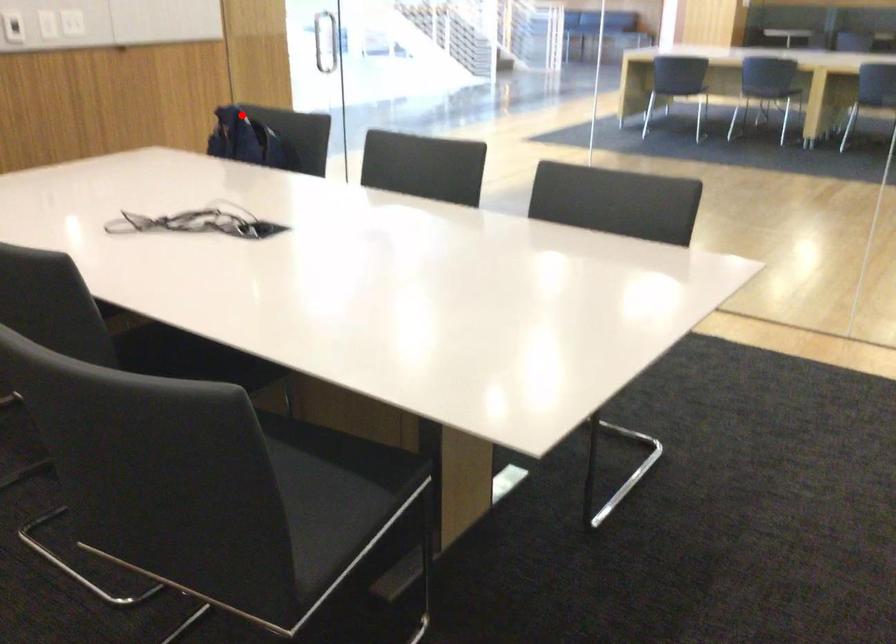
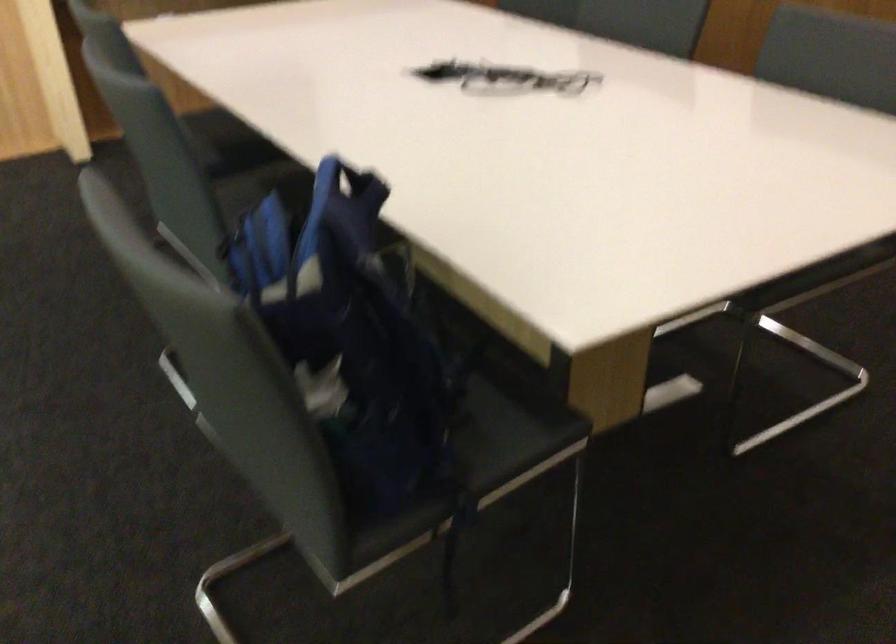
Where in the second image is the point corresponding to the highlighted location from the first image?

(349, 184)